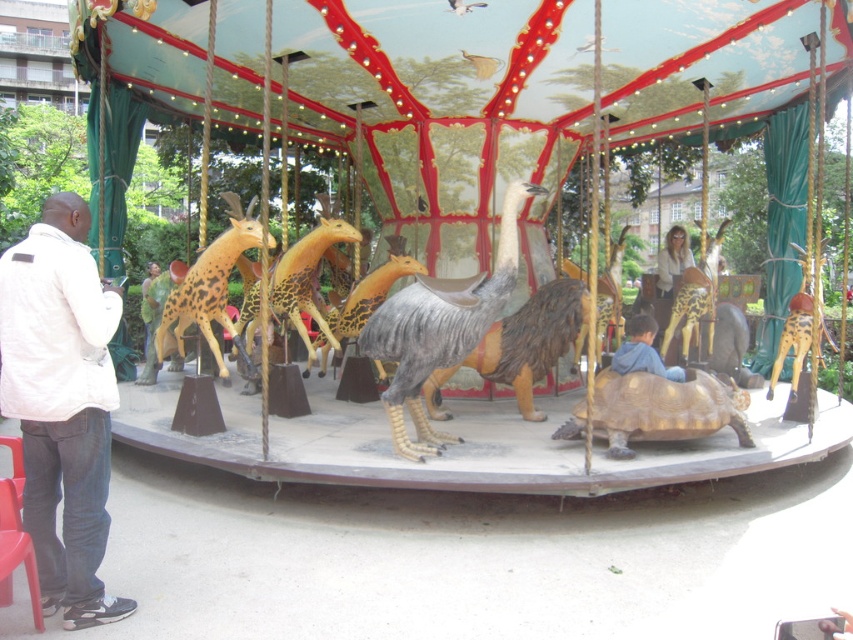
Question: Does blue cotton shirt at lower center lie behind matte gold sunglasses at center?

Choices:
 (A) no
 (B) yes

Answer: (A)

Question: Which point is farther to the camera?

Choices:
 (A) white cotton jacket at lower left
 (B) brown textured tortoise at center
 (C) blue cotton shirt at lower center

Answer: (C)

Question: Which object is positioned closest to the white cotton jacket at lower left?

Choices:
 (A) blue cotton shirt at lower center
 (B) brown textured tortoise at center
 (C) brown textured ostrich at center
 (D) green fabric shirt at center

Answer: (C)

Question: Can you confirm if golden metallic tortoise at center is smaller than green fabric shirt at center?

Choices:
 (A) yes
 (B) no

Answer: (A)

Question: Which is farther from the matte gold sunglasses at center?

Choices:
 (A) white cotton jacket at lower left
 (B) green fabric shirt at center

Answer: (B)

Question: Is brown textured ostrich at center to the left of golden metallic tortoise at center from the viewer's perspective?

Choices:
 (A) yes
 (B) no

Answer: (A)